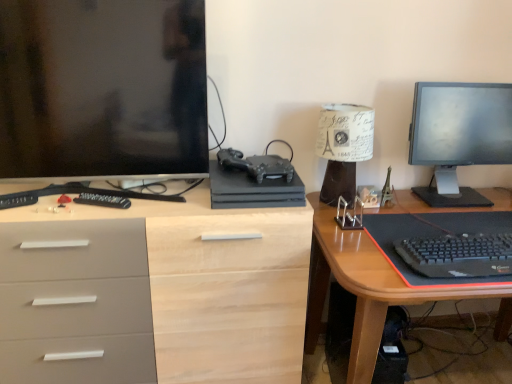
What is the approximate width of black plastic computer tower at lower right?

The width of black plastic computer tower at lower right is 7.98 inches.

Image resolution: width=512 pixels, height=384 pixels. Describe the element at coordinates (343, 148) in the screenshot. I see `white paper lampshade at upper right` at that location.

Measure the distance between wooden desk at right, positioned as the 2th desk in left-to-right order, and camera.

The depth of wooden desk at right, positioned as the 2th desk in left-to-right order, is 3.51 feet.

This screenshot has width=512, height=384. Find the location of `matte black monitor at left`. matte black monitor at left is located at coordinates (102, 88).

Where is `matte black monitor at upper right`? The image size is (512, 384). matte black monitor at upper right is located at coordinates (459, 136).

From the image's perspective, which is above, black plastic remote control at left, placed as the second remote control when sorted from right to left, or matte black monitor at upper right?

matte black monitor at upper right is shown above in the image.

From a real-world perspective, does black plastic remote control at left, placed as the second remote control when sorted from right to left, stand above matte black monitor at upper right?

No, from a real-world perspective, black plastic remote control at left, placed as the second remote control when sorted from right to left, is not on top of matte black monitor at upper right.

Identify the location of television located above the black plastic remote control at left, the first remote control in the left-to-right sequence (from the image's perspective). click(x=459, y=136).

Looking at this image, is black plastic remote control at left, placed as the second remote control when sorted from right to left, completely or partially outside of matte black monitor at upper right?

Absolutely, black plastic remote control at left, placed as the second remote control when sorted from right to left, is external to matte black monitor at upper right.

Which of these two, black plastic remote control at left, which is counted as the 1th remote control, starting from the right, or white paper lampshade at upper right, is wider?

Wider between the two is white paper lampshade at upper right.

Could you tell me if black plastic remote control at left, placed as the second remote control when sorted from left to right, is turned towards white paper lampshade at upper right?

No, black plastic remote control at left, placed as the second remote control when sorted from left to right, is not aimed at white paper lampshade at upper right.

Between black plastic remote control at left, which is counted as the 1th remote control, starting from the right, and white paper lampshade at upper right, which one has more height?

With more height is white paper lampshade at upper right.

From the image's perspective, who appears lower, black plastic remote control at left, placed as the second remote control when sorted from left to right, or white paper lampshade at upper right?

From the image's view, black plastic remote control at left, placed as the second remote control when sorted from left to right, is below.

Can you confirm if wooden desk at right, positioned as the 2th desk in left-to-right order, is taller than matte black gaming console at center?

Correct, wooden desk at right, positioned as the 2th desk in left-to-right order, is much taller as matte black gaming console at center.

What's the angular difference between wooden desk at right, which ranks as the 1th desk in right-to-left order, and matte black gaming console at center's facing directions?

0.915 degrees separate the facing orientations of wooden desk at right, which ranks as the 1th desk in right-to-left order, and matte black gaming console at center.

Identify the location of office supplies behind the wooden desk at right, positioned as the 2th desk in left-to-right order. (253, 189).

From a real-world perspective, which object rests below the other?

In real-world perspective, wooden desk at right, positioned as the 2th desk in left-to-right order, is lower.

From the picture: Considering the sizes of objects matte black monitor at upper right and matte wood desk at center, the first desk viewed from the left, in the image provided, who is bigger, matte black monitor at upper right or matte wood desk at center, the first desk viewed from the left,?

matte wood desk at center, the first desk viewed from the left.

This screenshot has width=512, height=384. In the image, there is a matte wood desk at center, arranged as the second desk when viewed from the right. In order to click on television above it (from the image's perspective) in this screenshot , I will do `click(459, 136)`.

Is matte black monitor at upper right situated inside matte wood desk at center, arranged as the second desk when viewed from the right, or outside?

matte black monitor at upper right is not inside matte wood desk at center, arranged as the second desk when viewed from the right, it's outside.

Is matte black monitor at left positioned far away from black plastic computer tower at lower right?

Yes.

Which object is positioned more to the left, matte black monitor at left or black plastic computer tower at lower right?

matte black monitor at left is more to the left.

Considering the sizes of matte black monitor at left and black plastic computer tower at lower right in the image, is matte black monitor at left wider or thinner than black plastic computer tower at lower right?

Considering their sizes, matte black monitor at left looks slimmer than black plastic computer tower at lower right.

Considering the relative sizes of black plastic computer tower at lower right and matte wood desk at center, the first desk viewed from the left, in the image provided, is black plastic computer tower at lower right shorter than matte wood desk at center, the first desk viewed from the left,?

Correct, black plastic computer tower at lower right is not as tall as matte wood desk at center, the first desk viewed from the left.

Can you confirm if black plastic computer tower at lower right is wider than matte wood desk at center, arranged as the second desk when viewed from the right?

No, black plastic computer tower at lower right is not wider than matte wood desk at center, arranged as the second desk when viewed from the right.

Between black plastic computer tower at lower right and matte wood desk at center, the first desk viewed from the left, which one is positioned behind?

black plastic computer tower at lower right is behind.

Looking at this image, how far apart are black matte keyboard at lower right and matte black monitor at upper right?

The distance of black matte keyboard at lower right from matte black monitor at upper right is 45.79 centimeters.

Can you confirm if black matte keyboard at lower right is wider than matte black monitor at upper right?

Indeed, black matte keyboard at lower right has a greater width compared to matte black monitor at upper right.

In the scene shown: Does black matte keyboard at lower right have a smaller size compared to matte black monitor at upper right?

Yes.

Could you tell me if black matte keyboard at lower right is facing matte black monitor at upper right?

No, black matte keyboard at lower right is not turned towards matte black monitor at upper right.

You are a GUI agent. You are given a task and a screenshot of the screen. Output one action in this format:
    pyautogui.click(x=<x>, y=<y>)
    Task: Click on the 2nd remote control to the left of the matte black monitor at upper right, starting your count from the anchor
    This screenshot has width=512, height=384.
    Given the screenshot: What is the action you would take?
    pyautogui.click(x=17, y=200)

Where is `lamp on the right side of black plastic remote control at left, which is counted as the 1th remote control, starting from the right`? lamp on the right side of black plastic remote control at left, which is counted as the 1th remote control, starting from the right is located at coordinates 343,148.

From the picture: From the image, which object appears to be farther from matte wood desk at center, arranged as the second desk when viewed from the right, black matte keyboard at lower right or matte black monitor at left?

black matte keyboard at lower right lies further to matte wood desk at center, arranged as the second desk when viewed from the right, than the other object.

Looking at the image, which one is located closer to matte black monitor at left, black matte keyboard at lower right or matte black monitor at upper right?

black matte keyboard at lower right lies closer to matte black monitor at left than the other object.

Considering their positions, is matte black gaming console at center positioned closer to matte black monitor at upper right than white paper lampshade at upper right?

Result: white paper lampshade at upper right lies closer to matte black monitor at upper right than the other object.

When comparing their distances from black matte keyboard at lower right, does matte black monitor at left or matte black gaming console at center seem further?

matte black monitor at left is positioned further to the anchor black matte keyboard at lower right.

Considering their positions, is black plastic remote control at left, which is counted as the 1th remote control, starting from the right, positioned closer to black matte keyboard at lower right than black plastic computer tower at lower right?

The object closer to black matte keyboard at lower right is black plastic computer tower at lower right.

Considering their positions, is black plastic computer tower at lower right positioned closer to matte black gaming console at center than matte wood desk at center, arranged as the second desk when viewed from the right?

The object closer to matte black gaming console at center is matte wood desk at center, arranged as the second desk when viewed from the right.

Based on the photo, when comparing their distances from matte black monitor at upper right, does black plastic computer tower at lower right or wooden desk at right, which ranks as the 1th desk in right-to-left order, seem further?

Among the two, black plastic computer tower at lower right is located further to matte black monitor at upper right.

Consider the image. Looking at the image, which one is located closer to wooden desk at right, positioned as the 2th desk in left-to-right order, matte black monitor at upper right or black matte keyboard at lower right?

Among the two, black matte keyboard at lower right is located nearer to wooden desk at right, positioned as the 2th desk in left-to-right order.

Find the location of a particular element. The image size is (512, 384). computer keyboard between white paper lampshade at upper right and black plastic computer tower at lower right in the vertical direction is located at coordinates pos(458,255).

Where is `computer keyboard between black plastic remote control at left, placed as the second remote control when sorted from right to left, and wooden desk at right, positioned as the 2th desk in left-to-right order, in the horizontal direction`? Image resolution: width=512 pixels, height=384 pixels. computer keyboard between black plastic remote control at left, placed as the second remote control when sorted from right to left, and wooden desk at right, positioned as the 2th desk in left-to-right order, in the horizontal direction is located at coordinates (458, 255).

Find the location of a particular element. lamp between matte black monitor at upper right and wooden desk at right, positioned as the 2th desk in left-to-right order, in the vertical direction is located at coordinates (343, 148).

Locate an element on the screen. The image size is (512, 384). remote control situated between matte black monitor at left and white paper lampshade at upper right from left to right is located at coordinates (103, 200).